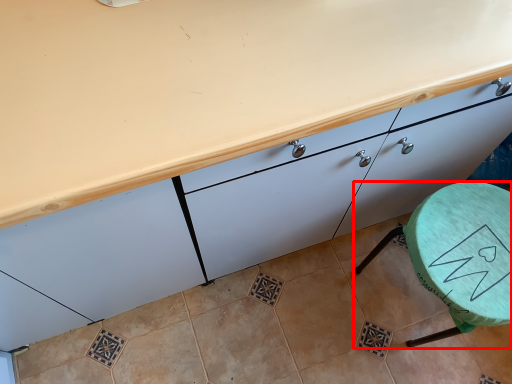
Question: From the image's perspective, what is the correct spatial positioning of furniture (annotated by the red box) in reference to cabinetry?

Choices:
 (A) below
 (B) above

Answer: (A)